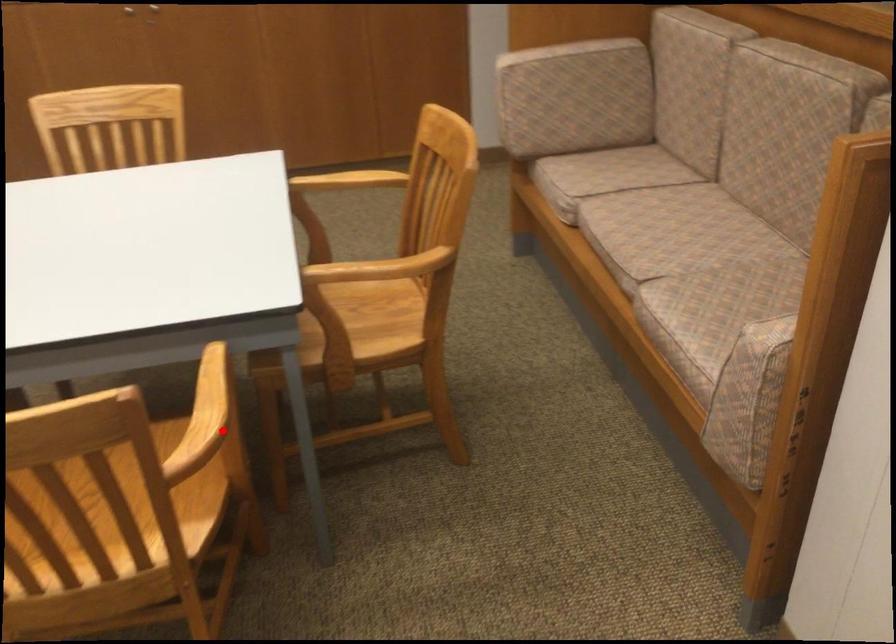
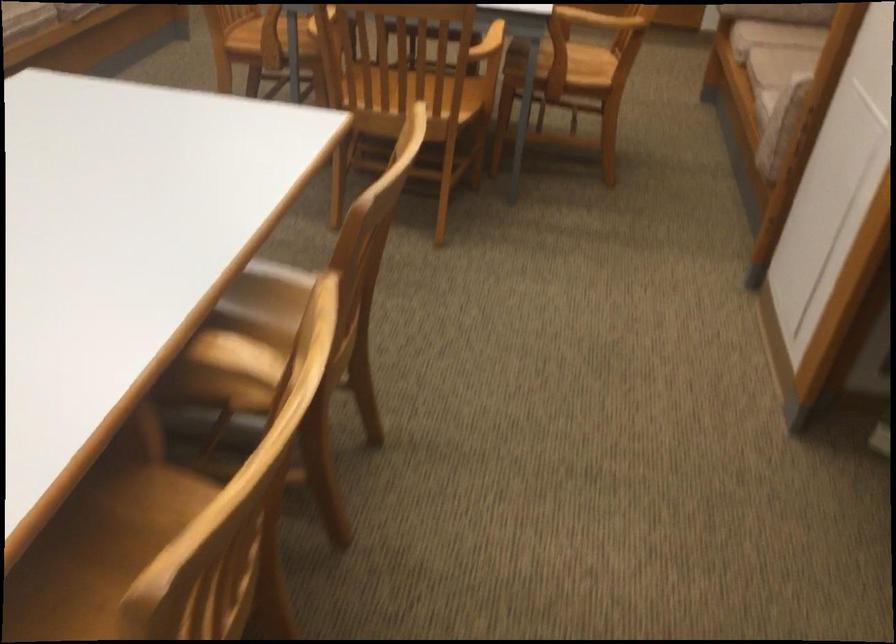
Find the pixel in the second image that matches the highlighted location in the first image.

(488, 43)